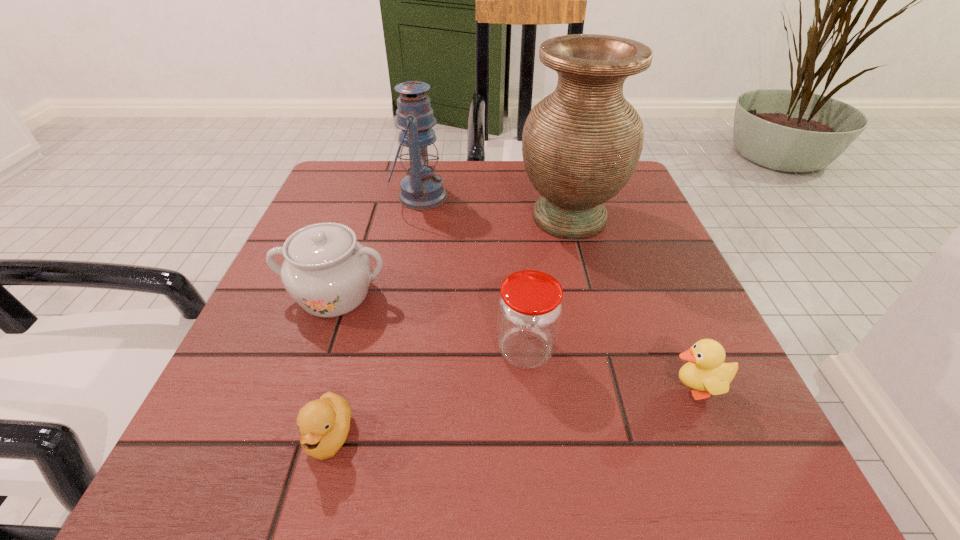
The image size is (960, 540). In the image, there is a desktop. In order to click on blank space at the near right corner in this screenshot , I will do `click(753, 438)`.

At what (x,y) coordinates should I click in order to perform the action: click on vacant area that lies between the jar and the lantern. Please return your answer as a coordinate pair (x, y). The image size is (960, 540). Looking at the image, I should click on (472, 274).

You are a GUI agent. You are given a task and a screenshot of the screen. Output one action in this format:
    pyautogui.click(x=<x>, y=<y>)
    Task: Click on the empty space between the left duckling and the second shortest object
    The image size is (960, 540).
    Given the screenshot: What is the action you would take?
    pos(513,413)

Where is `vacant area that lies between the jar and the shorter duckling`? The image size is (960, 540). vacant area that lies between the jar and the shorter duckling is located at coordinates (427, 394).

I want to click on free spot between the fourth nearest object and the second tallest object, so click(x=377, y=246).

Where is `free space between the left duckling and the fifth shortest object`? free space between the left duckling and the fifth shortest object is located at coordinates (375, 317).

I want to click on free area in between the fifth shortest object and the shorter duckling, so click(375, 317).

At what (x,y) coordinates should I click in order to perform the action: click on vacant region between the third farthest object and the tallest object. Please return your answer as a coordinate pair (x, y). The height and width of the screenshot is (540, 960). Looking at the image, I should click on (452, 256).

This screenshot has width=960, height=540. I want to click on free spot between the tallest object and the third farthest object, so click(452, 256).

This screenshot has width=960, height=540. In order to click on the third closest object to the fourth nearest object in this screenshot , I will do pos(530,307).